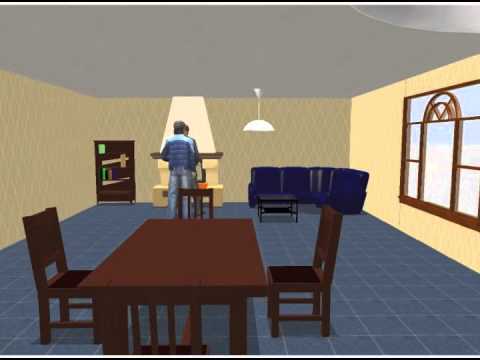
Locate an element on the screen. carpet is located at coordinates (403, 291).